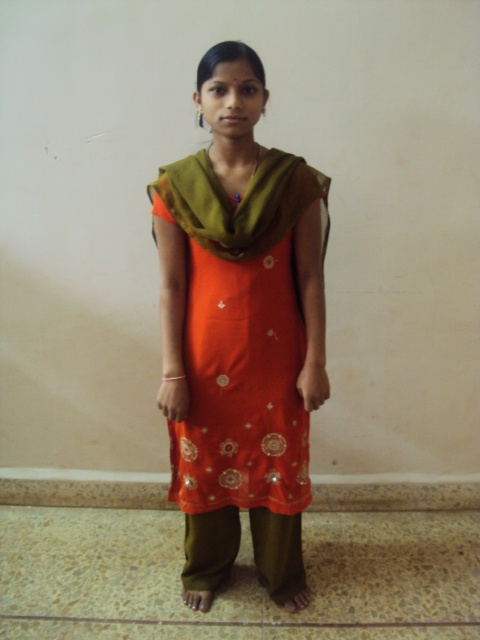
You are a fashion designer who wants to create a new outfit inspired by the image. You need to ensure that the new design maintains the height relationship between the orange satin kurta at center and the green sheer scarf at upper center. Which garment should be longer in your design?

The orange satin kurta at center is much taller than the green sheer scarf at upper center, so in the new design, the orange satin kurta at center should be longer than the green sheer scarf at upper center to maintain the height relationship.

You are a fashion designer looking to create a new outfit. You have a limited space in your design portfolio and need to know which item takes up more horizontal space. Based on the image, which item is wider between the orange satin kurta at center and the green sheer scarf at upper center?

The orange satin kurta at center has a lesser width compared to the green sheer scarf at upper center, so the green sheer scarf at upper center is wider.

You are a fashion designer analyzing the positioning of clothing items in the image. The orange satin kurta at center is located at point (x=240, y=333). Where exactly is the orange satin kurta at center positioned in the image?

The orange satin kurta at center is positioned at the coordinates point (x=240, y=333), which is the center of the image.